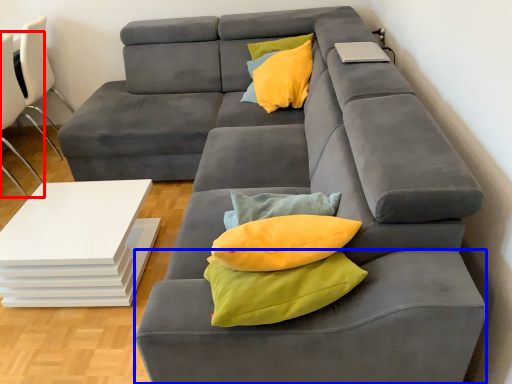
Question: Which of the following is the closest to the observer, chair (highlighted by a red box) or footrest (highlighted by a blue box)?

Choices:
 (A) chair
 (B) footrest

Answer: (B)